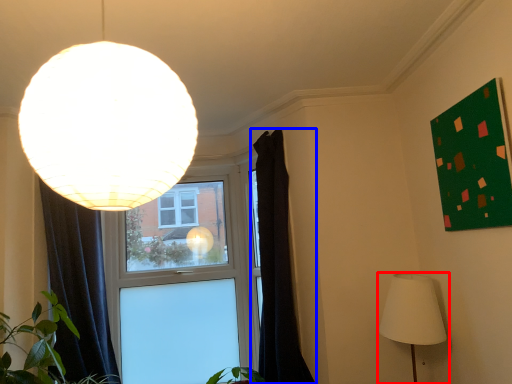
Question: Among these objects, which one is nearest to the camera, lamp (highlighted by a red box) or curtain (highlighted by a blue box)?

Choices:
 (A) lamp
 (B) curtain

Answer: (A)